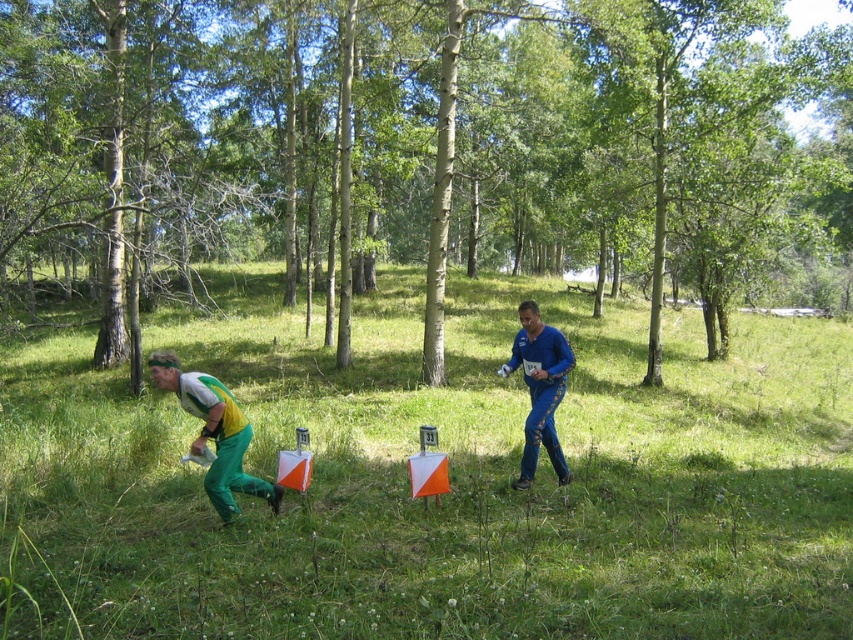
Based on the scene description, what object is located at the coordinates point [415,150]?

The brown bark tree at center is located at point [415,150].

You are an orienteer in a forest competition. You need to reach the brown bark tree at center as quickly as possible. There are two paths available. One goes through the point marked by coordinates point [415,150], and the other bypasses it. Which path should you choose?

The brown bark tree at center is represented by point [415,150], so you should choose the path that goes through point [415,150] to reach the brown bark tree at center directly.

You are an orienteer trying to locate the brown bark tree at center. According to the map, it is marked at coordinates point 0.236, 0.487. If you are currently at the starting point, which direction should you move to reach it?

The brown bark tree at center is located at point (415, 150), so you should move towards the center of the image to reach it.